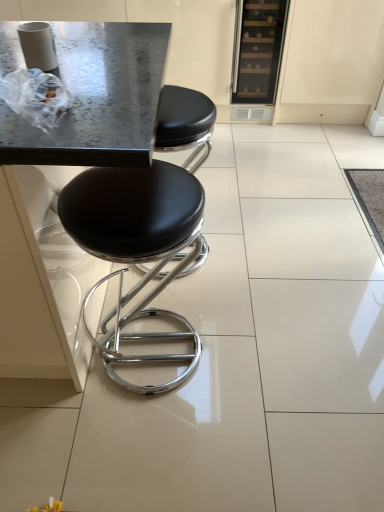
Question: Is metallic gray table at center positioned before black leather stool at center?

Choices:
 (A) yes
 (B) no

Answer: (A)

Question: Is metallic gray table at center at the left side of black leather stool at center?

Choices:
 (A) no
 (B) yes

Answer: (B)

Question: Is metallic gray table at center thinner than black leather stool at center?

Choices:
 (A) yes
 (B) no

Answer: (B)

Question: Is metallic gray table at center outside black leather stool at center?

Choices:
 (A) no
 (B) yes

Answer: (B)

Question: Can you confirm if metallic gray table at center is positioned to the right of black leather stool at center?

Choices:
 (A) yes
 (B) no

Answer: (B)

Question: From a real-world perspective, is black leather stool at center physically located above or below metallic gray table at center?

Choices:
 (A) above
 (B) below

Answer: (B)

Question: Considering the positions of black leather stool at center and metallic gray table at center in the image, is black leather stool at center wider or thinner than metallic gray table at center?

Choices:
 (A) thin
 (B) wide

Answer: (A)

Question: From the image's perspective, is black leather stool at center positioned above or below metallic gray table at center?

Choices:
 (A) above
 (B) below

Answer: (B)

Question: Considering their positions, is black leather stool at center located in front of or behind metallic gray table at center?

Choices:
 (A) behind
 (B) front

Answer: (A)

Question: From their relative heights in the image, would you say matte glass wine cooler at upper right is taller or shorter than black leather stool at center?

Choices:
 (A) tall
 (B) short

Answer: (B)

Question: In terms of size, does matte glass wine cooler at upper right appear bigger or smaller than black leather stool at center?

Choices:
 (A) small
 (B) big

Answer: (A)

Question: Considering the relative positions of matte glass wine cooler at upper right and black leather stool at center in the image provided, is matte glass wine cooler at upper right to the left or to the right of black leather stool at center?

Choices:
 (A) left
 (B) right

Answer: (B)

Question: From the image's perspective, relative to black leather stool at center, is matte glass wine cooler at upper right above or below?

Choices:
 (A) below
 (B) above

Answer: (B)

Question: Considering the positions of black leather stool at center and matte glass wine cooler at upper right in the image, is black leather stool at center taller or shorter than matte glass wine cooler at upper right?

Choices:
 (A) tall
 (B) short

Answer: (A)

Question: In the image, is black leather stool at center positioned in front of or behind matte glass wine cooler at upper right?

Choices:
 (A) front
 (B) behind

Answer: (A)